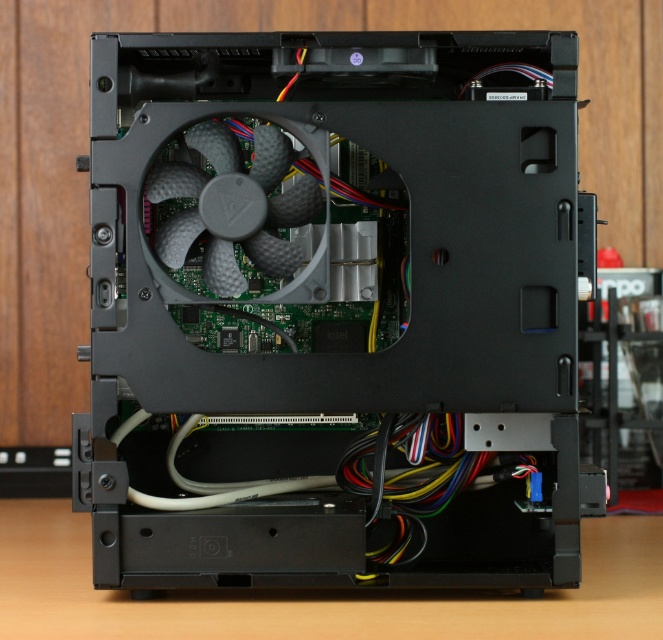
Question: In this image, where is black plastic fan at center located relative to gray matte fan at center?

Choices:
 (A) below
 (B) above

Answer: (A)

Question: Which object appears farthest from the camera in this image?

Choices:
 (A) gray matte fan at center
 (B) black plastic fan at center

Answer: (A)

Question: Where is black plastic fan at center located in relation to gray matte fan at center in the image?

Choices:
 (A) left
 (B) right

Answer: (B)

Question: Is black plastic fan at center above gray matte fan at center?

Choices:
 (A) no
 (B) yes

Answer: (A)

Question: Which point appears farthest from the camera in this image?

Choices:
 (A) (190, 129)
 (B) (241, 188)

Answer: (A)

Question: Which point appears closest to the camera in this image?

Choices:
 (A) (271, 250)
 (B) (514, 554)

Answer: (A)